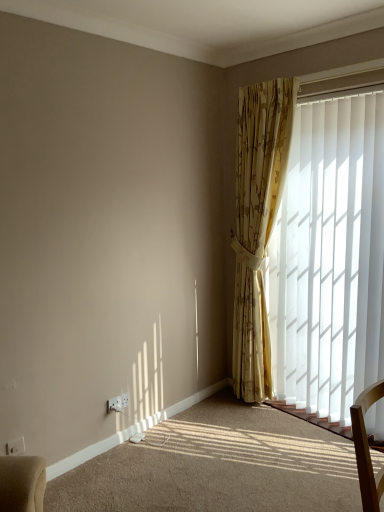
The image size is (384, 512). Find the location of `white vertical blinds at right`. white vertical blinds at right is located at coordinates (330, 258).

Measure the distance between point (363, 82) and camera.

They are 2.29 meters apart.

The height and width of the screenshot is (512, 384). Describe the element at coordinates (118, 403) in the screenshot. I see `white plastic electric outlet at lower left, which is counted as the first electric outlet, starting from the back` at that location.

Locate an element on the screen. This screenshot has height=512, width=384. white vertical blinds at right is located at coordinates (330, 258).

Considering the relative positions of white plastic window frame at upper right and white plastic electric outlet at lower left, arranged as the 1th electric outlet when viewed from the left, in the image provided, is white plastic window frame at upper right to the right of white plastic electric outlet at lower left, arranged as the 1th electric outlet when viewed from the left, from the viewer's perspective?

Yes, white plastic window frame at upper right is to the right of white plastic electric outlet at lower left, arranged as the 1th electric outlet when viewed from the left.

Is white plastic window frame at upper right not near white plastic electric outlet at lower left, marked as the 2th electric outlet in a right-to-left arrangement?

Yes, white plastic window frame at upper right and white plastic electric outlet at lower left, marked as the 2th electric outlet in a right-to-left arrangement, are quite far apart.

From a real-world perspective, count 1st electric outlets downward from the white plastic window frame at upper right and point to it. Please provide its 2D coordinates.

[(15, 446)]

Is white plastic window frame at upper right facing towards white plastic electric outlet at lower left, placed as the first electric outlet when sorted from front to back?

No, white plastic window frame at upper right does not turn towards white plastic electric outlet at lower left, placed as the first electric outlet when sorted from front to back.

Considering their positions, is white plastic electric outlet at lower left, placed as the first electric outlet when sorted from front to back, located in front of or behind white plastic window frame at upper right?

white plastic electric outlet at lower left, placed as the first electric outlet when sorted from front to back, is in front of white plastic window frame at upper right.

Does point (13, 452) come closer to viewer compared to point (314, 81)?

That is True.

From a real-world perspective, is white plastic electric outlet at lower left, arranged as the 1th electric outlet when viewed from the left, physically below white plastic window frame at upper right?

Yes.

Where is `the 1st electric outlet directly beneath the white plastic window frame at upper right (from a real-world perspective)`? the 1st electric outlet directly beneath the white plastic window frame at upper right (from a real-world perspective) is located at coordinates (15, 446).

Looking at this image, which point is more distant from viewer, (118, 406) or (370, 172)?

The point (118, 406) is more distant.

Based on the photo, measure the distance from white plastic electric outlet at lower left, marked as the 1th electric outlet in a right-to-left arrangement, to white vertical blinds at right.

A distance of 1.49 meters exists between white plastic electric outlet at lower left, marked as the 1th electric outlet in a right-to-left arrangement, and white vertical blinds at right.

Considering the relative sizes of white plastic electric outlet at lower left, which is counted as the first electric outlet, starting from the back, and white vertical blinds at right in the image provided, is white plastic electric outlet at lower left, which is counted as the first electric outlet, starting from the back, thinner than white vertical blinds at right?

Yes, white plastic electric outlet at lower left, which is counted as the first electric outlet, starting from the back, is thinner than white vertical blinds at right.

From the picture: From the image's perspective, which is above, white plastic electric outlet at lower left, positioned as the 2th electric outlet in front-to-back order, or white vertical blinds at right?

white vertical blinds at right appears higher in the image.

Is the surface of white vertical blinds at right in direct contact with white plastic window frame at upper right?

No, white vertical blinds at right is not with white plastic window frame at upper right.

Considering the relative sizes of white vertical blinds at right and white plastic window frame at upper right in the image provided, is white vertical blinds at right shorter than white plastic window frame at upper right?

Incorrect, the height of white vertical blinds at right does not fall short of that of white plastic window frame at upper right.

How different are the orientations of white vertical blinds at right and white plastic window frame at upper right in degrees?

white vertical blinds at right and white plastic window frame at upper right are facing 1.07 degrees away from each other.

Is point (315, 247) farther from viewer compared to point (299, 101)?

That is True.

From a real-world perspective, between white plastic electric outlet at lower left, the 2th electric outlet from the back, and white vertical blinds at right, who is vertically lower?

In real-world perspective, white plastic electric outlet at lower left, the 2th electric outlet from the back, is lower.

Can you tell me how much white plastic electric outlet at lower left, arranged as the 1th electric outlet when viewed from the left, and white vertical blinds at right differ in facing direction?

There is a 89.9-degree angle between the facing directions of white plastic electric outlet at lower left, arranged as the 1th electric outlet when viewed from the left, and white vertical blinds at right.

Does white plastic electric outlet at lower left, placed as the first electric outlet when sorted from front to back, appear on the right side of white vertical blinds at right?

Incorrect, white plastic electric outlet at lower left, placed as the first electric outlet when sorted from front to back, is not on the right side of white vertical blinds at right.

Considering the relative sizes of white plastic electric outlet at lower left, arranged as the 1th electric outlet when viewed from the left, and white vertical blinds at right in the image provided, is white plastic electric outlet at lower left, arranged as the 1th electric outlet when viewed from the left, smaller than white vertical blinds at right?

Yes, white plastic electric outlet at lower left, arranged as the 1th electric outlet when viewed from the left, is smaller than white vertical blinds at right.

Looking at this image, who is bigger, white vertical blinds at right or gold floral curtain at right?

Bigger between the two is gold floral curtain at right.

Can you confirm if white vertical blinds at right is shorter than gold floral curtain at right?

Yes.

This screenshot has height=512, width=384. Find the location of `curtain above the white vertical blinds at right (from the image's perspective)`. curtain above the white vertical blinds at right (from the image's perspective) is located at coordinates (257, 224).

Is gold floral curtain at right next to white plastic electric outlet at lower left, positioned as the 2th electric outlet in front-to-back order, and touching it?

No, gold floral curtain at right is not in contact with white plastic electric outlet at lower left, positioned as the 2th electric outlet in front-to-back order.

Between gold floral curtain at right and white plastic electric outlet at lower left, marked as the 1th electric outlet in a right-to-left arrangement, which one has larger size?

Bigger between the two is gold floral curtain at right.

You are a GUI agent. You are given a task and a screenshot of the screen. Output one action in this format:
    pyautogui.click(x=<x>, y=<y>)
    Task: Click on the 1st electric outlet counting from the left side of the gold floral curtain at right
    
    Given the screenshot: What is the action you would take?
    pyautogui.click(x=118, y=403)

Locate an element on the screen. This screenshot has height=512, width=384. electric outlet that is in front of the white plastic window frame at upper right is located at coordinates (15, 446).

Starting from the white plastic window frame at upper right, which electric outlet is the 2nd one to the left? Please provide its 2D coordinates.

[(15, 446)]

Looking at the image, which one is located closer to white plastic electric outlet at lower left, which ranks as the second electric outlet in left-to-right order, gold floral curtain at right or white plastic electric outlet at lower left, marked as the 2th electric outlet in a right-to-left arrangement?

white plastic electric outlet at lower left, marked as the 2th electric outlet in a right-to-left arrangement.

Based on their spatial positions, is white vertical blinds at right or white plastic window frame at upper right closer to white plastic electric outlet at lower left, positioned as the 2th electric outlet in front-to-back order?

Based on the image, white vertical blinds at right appears to be nearer to white plastic electric outlet at lower left, positioned as the 2th electric outlet in front-to-back order.

Based on their spatial positions, is white plastic electric outlet at lower left, positioned as the 2th electric outlet in front-to-back order, or gold floral curtain at right further from white plastic electric outlet at lower left, marked as the 2th electric outlet in a right-to-left arrangement?

Based on the image, gold floral curtain at right appears to be further to white plastic electric outlet at lower left, marked as the 2th electric outlet in a right-to-left arrangement.

Considering their positions, is white plastic electric outlet at lower left, arranged as the 1th electric outlet when viewed from the left, positioned closer to gold floral curtain at right than white plastic window frame at upper right?

The object closer to gold floral curtain at right is white plastic window frame at upper right.

Which object lies nearer to the anchor point white plastic electric outlet at lower left, which is counted as the first electric outlet, starting from the back, white plastic electric outlet at lower left, arranged as the 1th electric outlet when viewed from the left, or white vertical blinds at right?

Based on the image, white plastic electric outlet at lower left, arranged as the 1th electric outlet when viewed from the left, appears to be nearer to white plastic electric outlet at lower left, which is counted as the first electric outlet, starting from the back.

Based on their spatial positions, is white plastic electric outlet at lower left, which ranks as the second electric outlet in left-to-right order, or white vertical blinds at right closer to white plastic electric outlet at lower left, placed as the first electric outlet when sorted from front to back?

The object closer to white plastic electric outlet at lower left, placed as the first electric outlet when sorted from front to back, is white plastic electric outlet at lower left, which ranks as the second electric outlet in left-to-right order.

From the image, which object appears to be nearer to gold floral curtain at right, white plastic window frame at upper right or white plastic electric outlet at lower left, marked as the 2th electric outlet in a right-to-left arrangement?

The object closer to gold floral curtain at right is white plastic window frame at upper right.

Considering their positions, is gold floral curtain at right positioned further to white vertical blinds at right than white plastic window frame at upper right?

white plastic window frame at upper right is positioned further to the anchor white vertical blinds at right.

Where is `window between white plastic window frame at upper right and white plastic electric outlet at lower left, marked as the 1th electric outlet in a right-to-left arrangement, vertically`? The image size is (384, 512). window between white plastic window frame at upper right and white plastic electric outlet at lower left, marked as the 1th electric outlet in a right-to-left arrangement, vertically is located at coordinates (330, 258).

I want to click on curtain that lies between white plastic window frame at upper right and white plastic electric outlet at lower left, marked as the 1th electric outlet in a right-to-left arrangement, from top to bottom, so click(257, 224).

This screenshot has height=512, width=384. Identify the location of window situated between white plastic electric outlet at lower left, placed as the first electric outlet when sorted from front to back, and white plastic window frame at upper right from left to right. (330, 258).

Image resolution: width=384 pixels, height=512 pixels. I want to click on electric outlet between white plastic electric outlet at lower left, the 2th electric outlet from the back, and gold floral curtain at right, in the horizontal direction, so click(x=118, y=403).